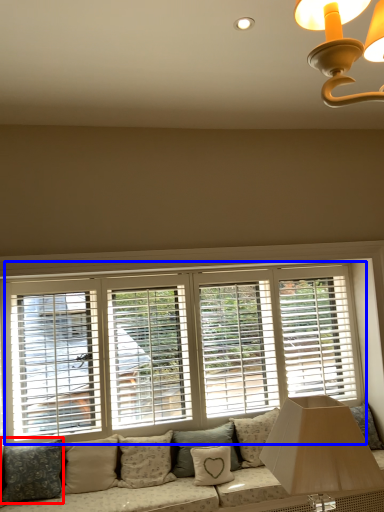
Question: Which object appears closest to the camera in this image, pillow (highlighted by a red box) or window (highlighted by a blue box)?

Choices:
 (A) pillow
 (B) window

Answer: (A)